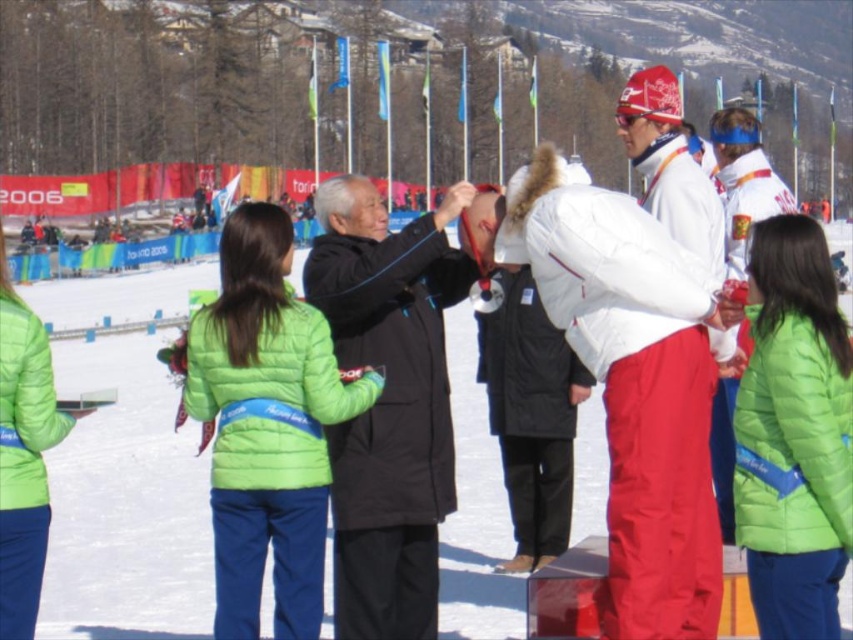
You are a photographer at the winter sports event. You need to capture a photo where the white snow at center and the green matte jacket at center are both visible. Which object will occupy more space in the photo?

The white snow at center is bigger than the green matte jacket at center, so it will occupy more space in the photo.

You are a photographer at the winter sports event. You need to capture a photo of the white snow at center and the green matte jacket at center. Which object is located above the other in the image?

The white snow at center is positioned over the green matte jacket at center, meaning the white snow at center is above the green matte jacket at center in the image.

You are a photographer at the event and need to capture a photo where both the white matte jacket at center and the black matte jacket at center are visible. Based on their positions, which jacket should be placed lower in the frame to ensure both are fully visible?

The white matte jacket at center is located below the black matte jacket at center, so to ensure both are fully visible in the photo, the white matte jacket at center should be placed lower in the frame.